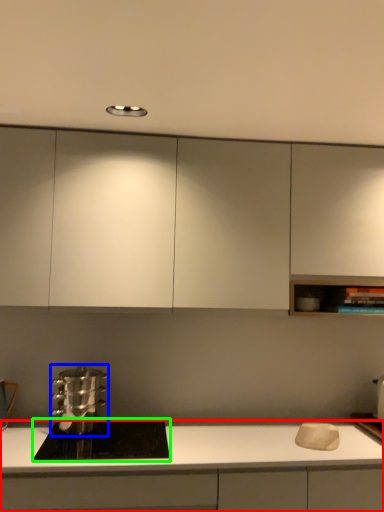
Question: Estimate the real-world distances between objects in this image. Which object is closer to cabinetry (highlighted by a red box), kitchen appliance (highlighted by a blue box) or home appliance (highlighted by a green box)?

Choices:
 (A) kitchen appliance
 (B) home appliance

Answer: (B)